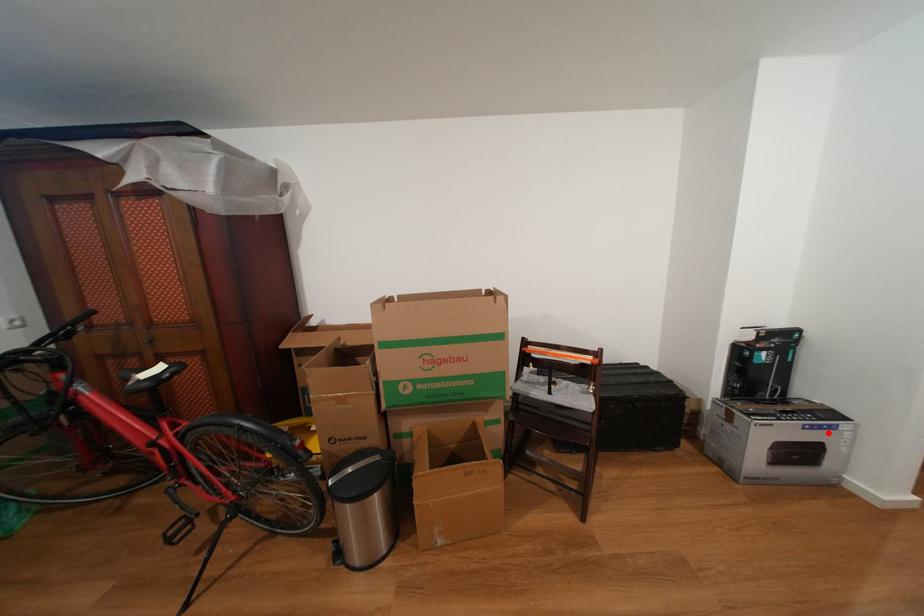
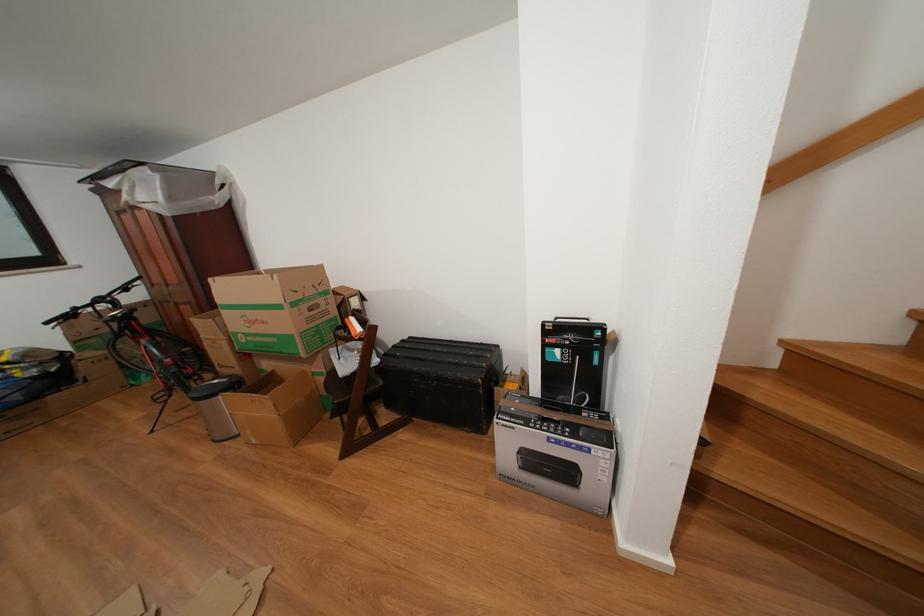
Where in the second image is the point corresponding to the highlighted location from the first image?

(576, 450)